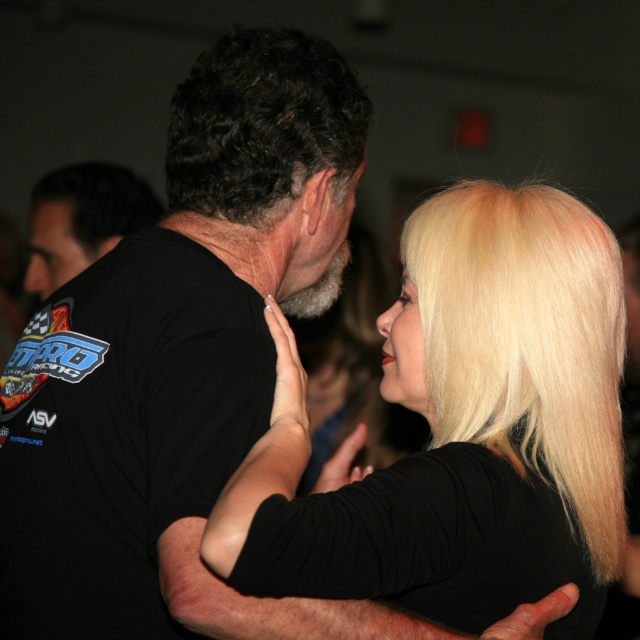
Question: Which point is closer to the camera?

Choices:
 (A) blonde silky hair at right
 (B) dark curly hair at upper center
 (C) black fabric shirt at left
 (D) blonde hair at upper right

Answer: (D)

Question: Which of the following is the closest to the observer?

Choices:
 (A) blonde hair at upper right
 (B) blonde silky hair at right
 (C) dark curly hair at upper center
 (D) black fabric shirt at left

Answer: (A)

Question: Is blonde hair at upper right to the left of black fabric shirt at left from the viewer's perspective?

Choices:
 (A) yes
 (B) no

Answer: (B)

Question: Which of the following is the closest to the observer?

Choices:
 (A) (499, 433)
 (B) (156, 211)
 (C) (584, 262)

Answer: (A)

Question: Is dark curly hair at upper center positioned in front of black fabric shirt at left?

Choices:
 (A) yes
 (B) no

Answer: (A)

Question: Can you confirm if blonde hair at upper right is bigger than dark curly hair at upper center?

Choices:
 (A) yes
 (B) no

Answer: (A)